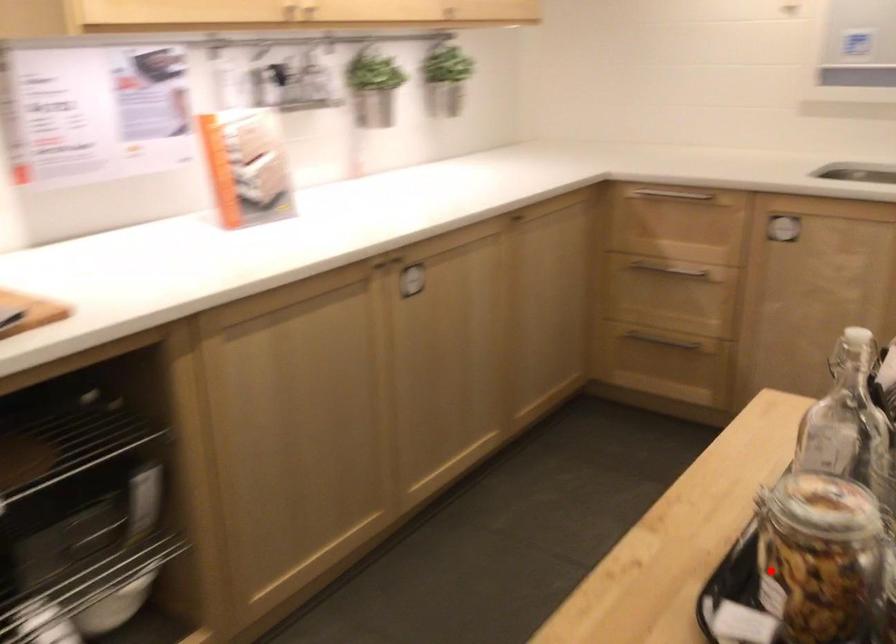
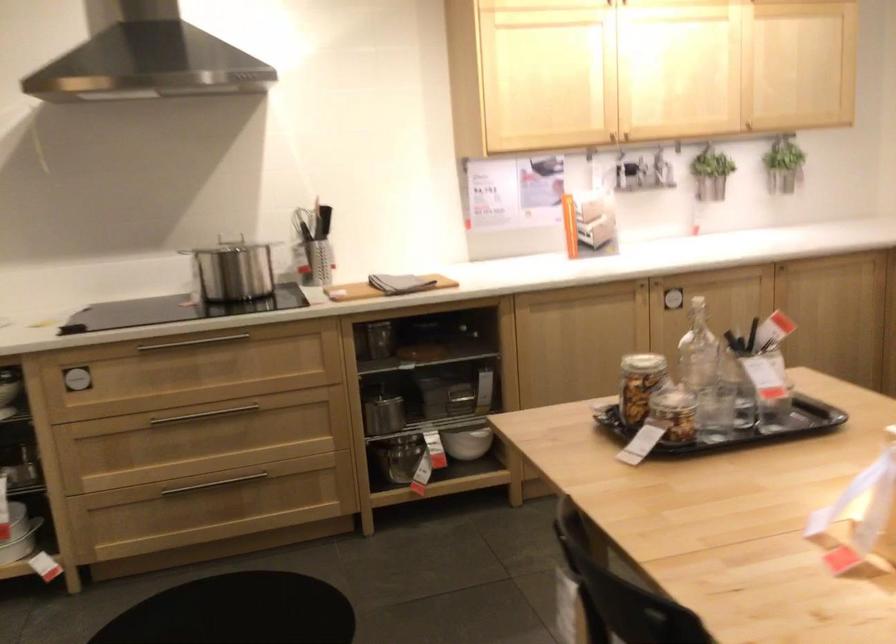
Question: I am providing you with two images of the same scene from different viewpoints. In image1, a red point is highlighted. Considering the same 3D point in image2, which of the following is correct?

Choices:
 (A) It is closer
 (B) It is farther

Answer: (B)